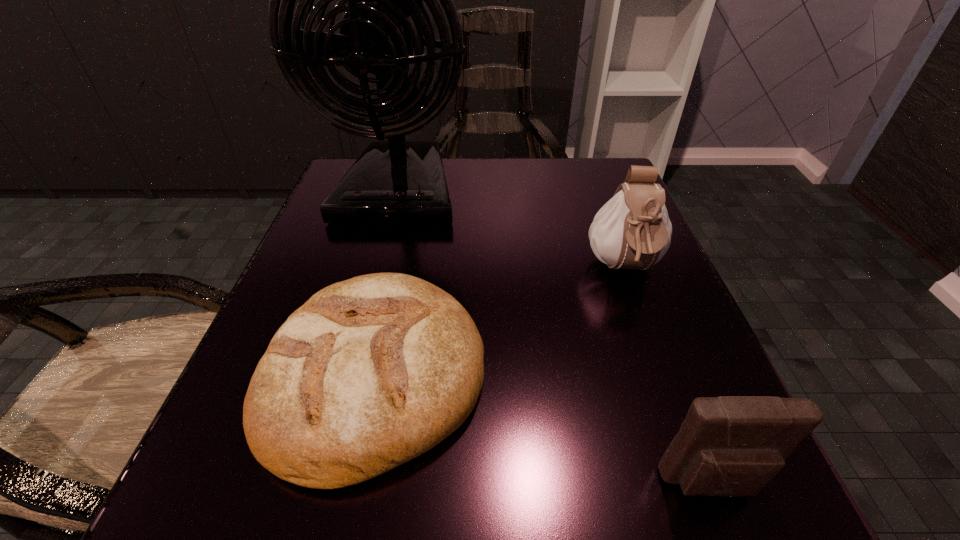
This screenshot has height=540, width=960. What are the coordinates of `object positioned at the far edge` in the screenshot? It's located at (396, 181).

Find the location of a particular element. The width and height of the screenshot is (960, 540). pouch at the near edge is located at coordinates (731, 446).

Where is `bread situated at the near edge`? bread situated at the near edge is located at coordinates click(x=371, y=372).

Locate an element on the screen. The width and height of the screenshot is (960, 540). fan that is at the left edge is located at coordinates (396, 181).

Identify the location of bread that is at the left edge. (371, 372).

You are a GUI agent. You are given a task and a screenshot of the screen. Output one action in this format:
    pyautogui.click(x=<x>, y=<y>)
    Task: Click on the object present at the far left corner
    Image resolution: width=960 pixels, height=540 pixels.
    Given the screenshot: What is the action you would take?
    pyautogui.click(x=396, y=181)

This screenshot has height=540, width=960. Find the location of `object that is at the near left corner`. object that is at the near left corner is located at coordinates (371, 372).

Locate an element on the screen. This screenshot has height=540, width=960. object located in the near right corner section of the desktop is located at coordinates (731, 446).

Where is `vacant space at the far edge`? Image resolution: width=960 pixels, height=540 pixels. vacant space at the far edge is located at coordinates (556, 202).

The width and height of the screenshot is (960, 540). I want to click on vacant area at the near edge of the desktop, so click(588, 523).